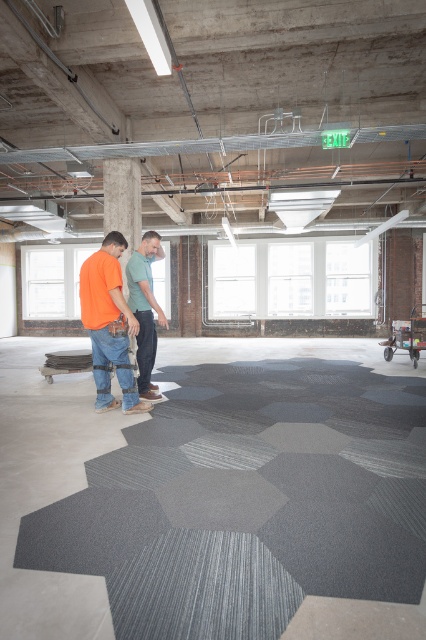
You are standing in the construction area and need to locate the person in the matte orange shirt at center. Which direction should you look relative to the person in the matte green shirt at center?

The matte orange shirt at center is located below the matte green shirt at center, so you should look downward from the matte green shirt at center to find the matte orange shirt at center.

You are a contractor measuring the width of two workers in the room. The workers are wearing the matte orange shirt at center and the matte green shirt at center. Which worker has a wider shirt?

The matte orange shirt at center has a larger width than the matte green shirt at center.